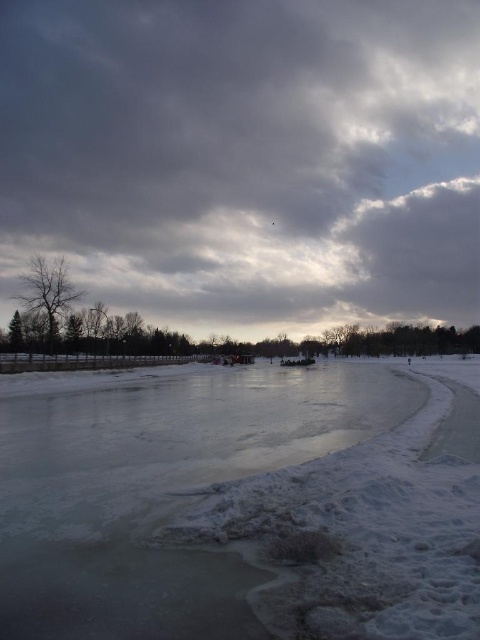
You are planning to build a snowman on the white ice at center. Considering the height of the gray cloudy sky at upper center, will the snowman be visible from a distance?

The gray cloudy sky at upper center is much taller than the white ice at center, so the snowman built on the white ice at center would be visible against the sky backdrop as the sky is significantly higher.

You are standing at the edge of the frozen lake and want to walk to the group of people near the gray cloudy sky at upper center. The distance between you and them is 73.31 meters. If your walking speed is 1.5 meters per second, how many seconds will it take you to reach them?

The distance between you and the group of people near the gray cloudy sky at upper center is 73.31 meters. At a walking speed of 1.5 meters per second, it will take approximately 48.87 seconds to reach them.